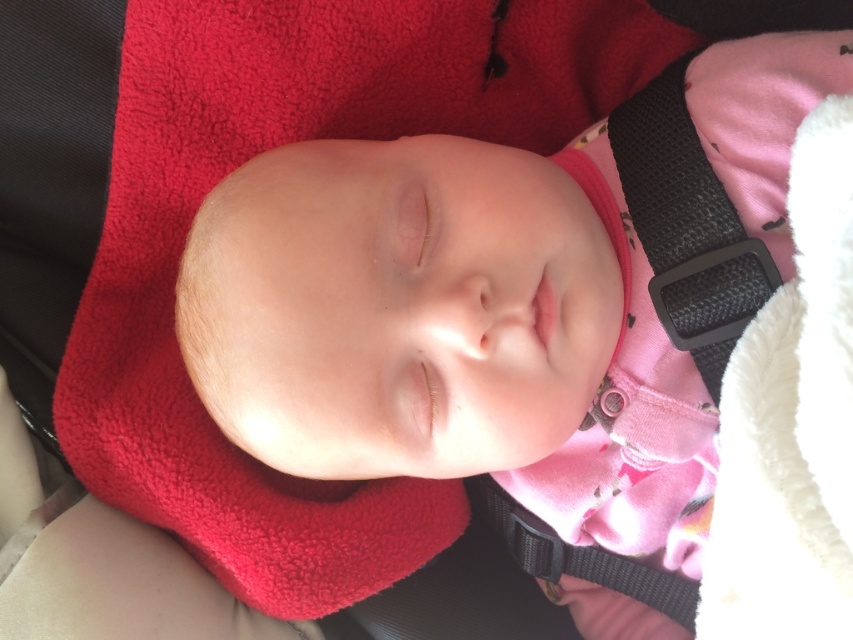
Question: Which point is farther from the camera taking this photo?

Choices:
 (A) (503, 492)
 (B) (751, 260)

Answer: (A)

Question: Is black textured strap at upper right further to camera compared to black fabric strap at lower center?

Choices:
 (A) yes
 (B) no

Answer: (B)

Question: Among these points, which one is nearest to the camera?

Choices:
 (A) (595, 577)
 (B) (619, 141)

Answer: (B)

Question: Which point is farther from the camera taking this photo?

Choices:
 (A) (529, 560)
 (B) (721, 339)

Answer: (A)

Question: In this image, where is black textured strap at upper right located relative to black fabric strap at lower center?

Choices:
 (A) left
 (B) right

Answer: (B)

Question: From the image, what is the correct spatial relationship of black textured strap at upper right in relation to black fabric strap at lower center?

Choices:
 (A) right
 (B) left

Answer: (A)